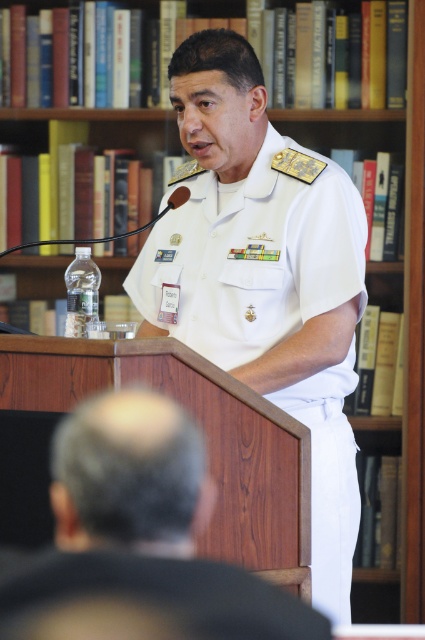
You are a photographer standing in the library and want to take a photo of the podium and the bookshelves. You notice two points marked in the scene. The first point is at coordinate point (340, 442) and the second is at point (124, 620). Which point is closer to you, the photographer?

Point (340, 442) is further to the viewer than point (124, 620), so the second point is closer to you.

You are a photographer in a library setting. You need to take a photo of the man in the white cotton uniform at center and the white uniform at center. Which one is on the right side?

The white cotton uniform at center is positioned on the right side of white uniform at center.